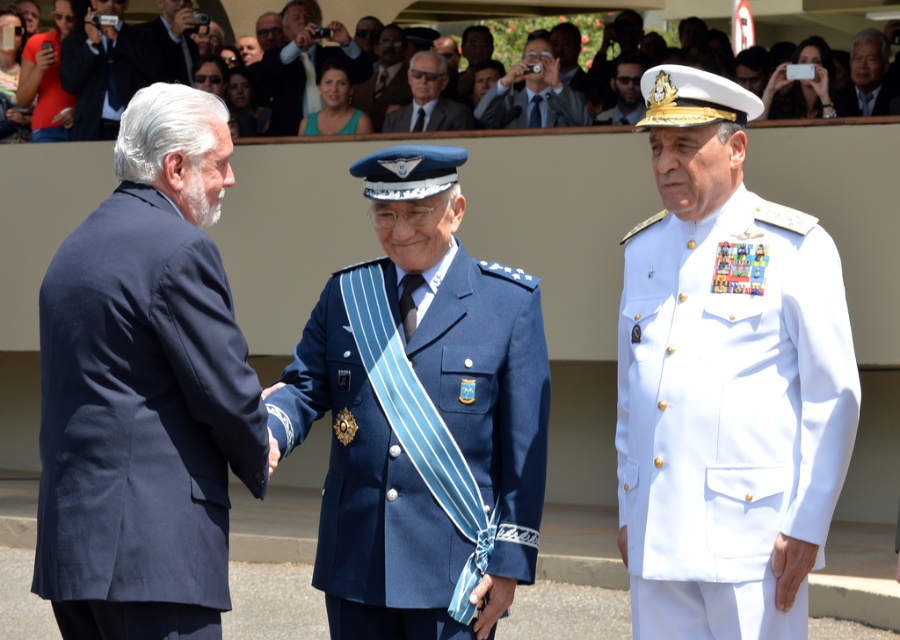
Is blue fabric uniform at center to the left of red cotton t-shirt at upper left from the viewer's perspective?

In fact, blue fabric uniform at center is to the right of red cotton t-shirt at upper left.

Describe the element at coordinates (361, 477) in the screenshot. I see `blue fabric uniform at center` at that location.

This screenshot has width=900, height=640. What do you see at coordinates (361, 477) in the screenshot?
I see `blue fabric uniform at center` at bounding box center [361, 477].

Identify the location of blue fabric uniform at center. (361, 477).

Does blue fabric uniform at center appear over matte black camera at upper center?

Actually, blue fabric uniform at center is below matte black camera at upper center.

Who is higher up, blue fabric uniform at center or matte black camera at upper center?

Positioned higher is matte black camera at upper center.

What do you see at coordinates (361, 477) in the screenshot?
I see `blue fabric uniform at center` at bounding box center [361, 477].

The height and width of the screenshot is (640, 900). Find the location of `blue fabric uniform at center`. blue fabric uniform at center is located at coordinates (361, 477).

The height and width of the screenshot is (640, 900). What do you see at coordinates (868, 77) in the screenshot?
I see `gray hair at upper right` at bounding box center [868, 77].

The width and height of the screenshot is (900, 640). Identify the location of gray hair at upper right. (868, 77).